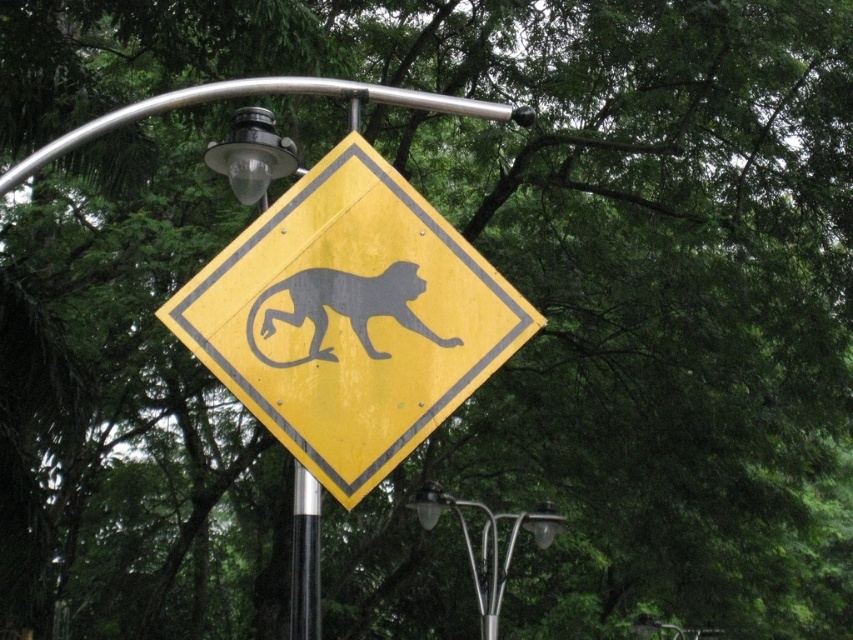
Question: Among these points, which one is nearest to the camera?

Choices:
 (A) (254, 193)
 (B) (412, 388)

Answer: (B)

Question: Which object appears farthest from the camera in this image?

Choices:
 (A) black glossy pole at center
 (B) metallic silver streetlight at lower center
 (C) yellow reflective diamond at center
 (D) gray matte/soft plastic monkey at center

Answer: (B)

Question: Which of the following is the farthest from the observer?

Choices:
 (A) (299, 358)
 (B) (317, 561)
 (C) (299, 480)

Answer: (C)

Question: Can you confirm if gray matte/soft plastic monkey at center is positioned to the left of black glossy pole at center?

Choices:
 (A) yes
 (B) no

Answer: (B)

Question: Can you confirm if metallic glass street light at upper center is wider than gray matte/soft plastic monkey at center?

Choices:
 (A) no
 (B) yes

Answer: (A)

Question: Is metallic glass street light at upper center positioned behind gray matte/soft plastic monkey at center?

Choices:
 (A) yes
 (B) no

Answer: (A)